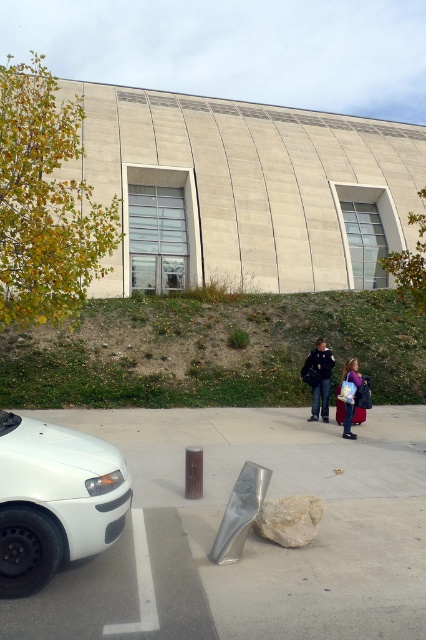
This screenshot has height=640, width=426. What do you see at coordinates (54, 499) in the screenshot?
I see `white matte car at lower left` at bounding box center [54, 499].

Is white matte car at lower left positioned behind denim jacket at lower right?

No.

Is point (66, 544) farther from camera compared to point (351, 372)?

No, (66, 544) is in front of (351, 372).

You are a GUI agent. You are given a task and a screenshot of the screen. Output one action in this format:
    pyautogui.click(x=<x>, y=<y>)
    Task: Click on the white matte car at lower left
    The width and height of the screenshot is (426, 640).
    Given the screenshot: What is the action you would take?
    pyautogui.click(x=54, y=499)

Who is taller, green grassy hillside at lower left or denim jacket at lower right?

green grassy hillside at lower left is taller.

Between point (58, 340) and point (345, 417), which one is positioned in front?

Point (345, 417) is more forward.

You are a GUI agent. You are given a task and a screenshot of the screen. Output one action in this format:
    pyautogui.click(x=<x>, y=<y>)
    Task: Click on the green grassy hillside at lower left
    The image size is (426, 640).
    Given the screenshot: What is the action you would take?
    pyautogui.click(x=213, y=352)

I want to click on green grassy hillside at lower left, so click(213, 352).

Does green grassy hillside at lower left have a larger size compared to dark blue jacket at center?

Correct, green grassy hillside at lower left is larger in size than dark blue jacket at center.

Describe the element at coordinates (213, 352) in the screenshot. I see `green grassy hillside at lower left` at that location.

I want to click on green grassy hillside at lower left, so click(213, 352).